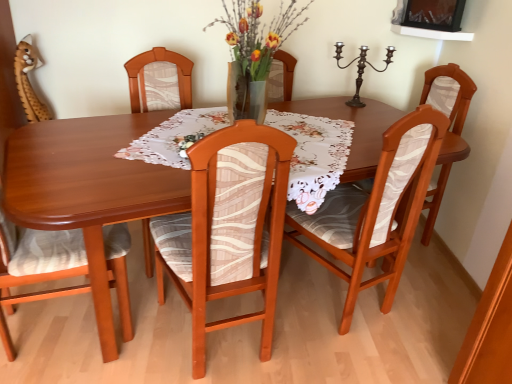
Where is `free space in front of wooden chair at center, which is the fourth chair from left to right`? free space in front of wooden chair at center, which is the fourth chair from left to right is located at coordinates (347, 355).